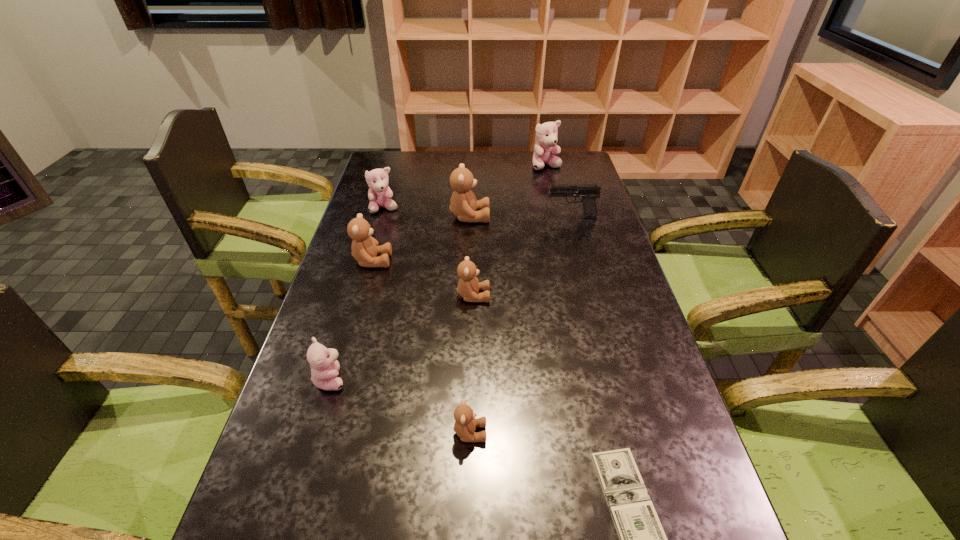
The width and height of the screenshot is (960, 540). In order to click on free space that is in between the second nearest brown teddy bear and the shortest teddy bear in this screenshot , I will do `click(471, 364)`.

Image resolution: width=960 pixels, height=540 pixels. I want to click on free spot between the farthest brown teddy bear and the leftmost brown teddy bear, so click(x=421, y=239).

At what (x,y) coordinates should I click in order to perform the action: click on free point between the pistol and the nearest pink teddy bear. Please return your answer as a coordinate pair (x, y). Looking at the image, I should click on (451, 298).

Locate an element on the screen. free space between the second nearest object and the farthest brown teddy bear is located at coordinates (469, 325).

Image resolution: width=960 pixels, height=540 pixels. Identify the location of free space between the biggest brown teddy bear and the smallest pink teddy bear. (400, 298).

At what (x,y) coordinates should I click in order to perform the action: click on object that is the fourth closest to the second smallest pink teddy bear. Please return your answer as a coordinate pair (x, y). Looking at the image, I should click on (589, 192).

Find the location of `object identified as the second closest to the third biggest brown teddy bear`. object identified as the second closest to the third biggest brown teddy bear is located at coordinates (463, 204).

Locate which teddy bear is the third closest to the farthest object. Please provide its 2D coordinates. Your answer should be formatted as a tuple, i.e. [(x, y)], where the tuple contains the x and y coordinates of a point satisfying the conditions above.

[(468, 286)]

The image size is (960, 540). Identify the location of teddy bear that is the second closest to the second biggest pink teddy bear. coord(365,248).

You are a GUI agent. You are given a task and a screenshot of the screen. Output one action in this format:
    pyautogui.click(x=<x>, y=<y>)
    Task: Click on the third closest pink teddy bear to the nearest brown teddy bear
    
    Given the screenshot: What is the action you would take?
    pyautogui.click(x=546, y=134)